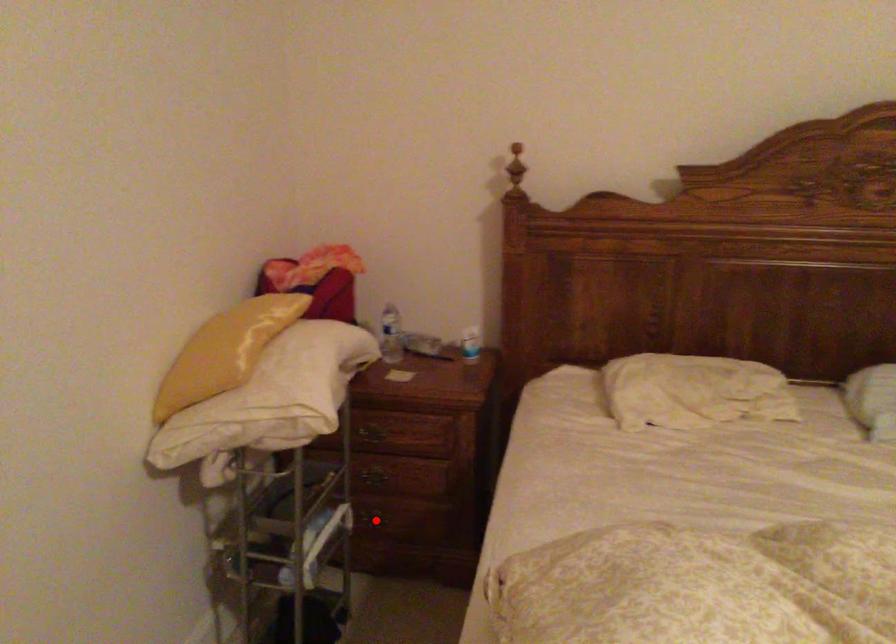
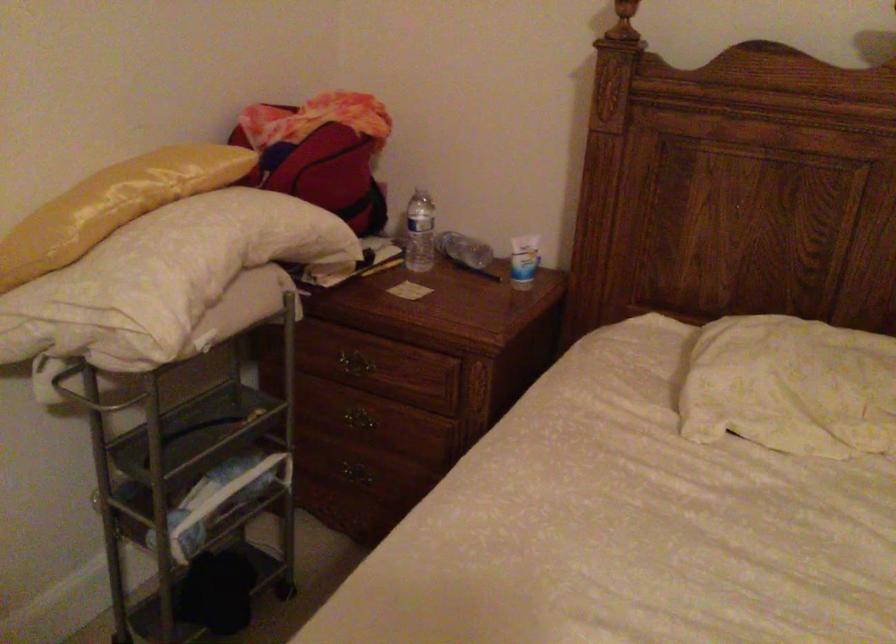
Question: I am providing you with two images of the same scene from different viewpoints. Given a red point in image1, look at the same physical point in image2. Is it:

Choices:
 (A) Closer to the viewpoint
 (B) Farther from the viewpoint

Answer: (A)